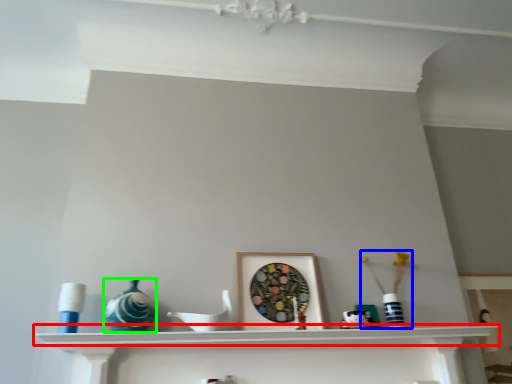
Question: Which object is positioned farthest from shelf (highlighted by a red box)? Select from toy (highlighted by a blue box) and glass vase (highlighted by a green box).

Choices:
 (A) toy
 (B) glass vase

Answer: (A)